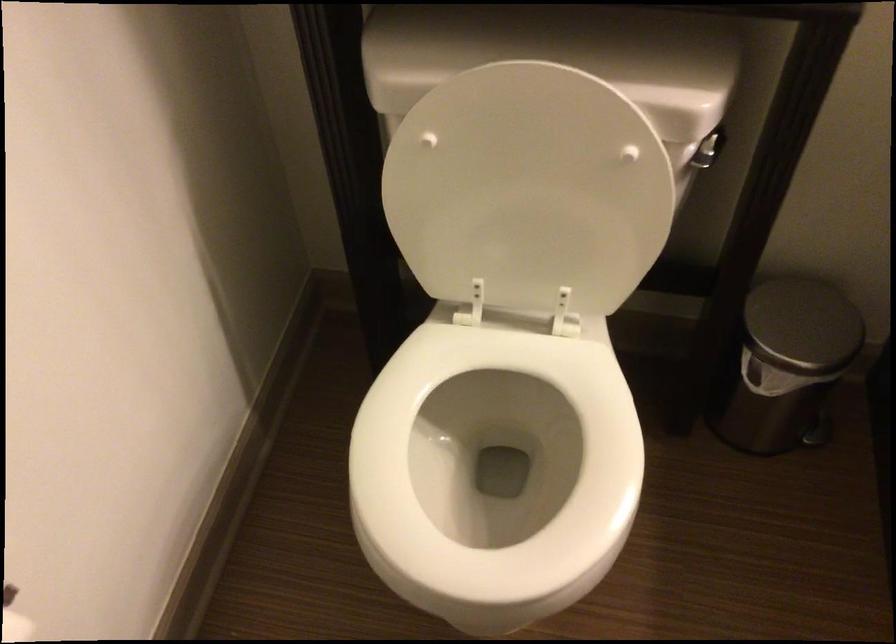
Find where to push the trash can pedal. Please return your answer as a coordinate pair (x, y).

(817, 431)